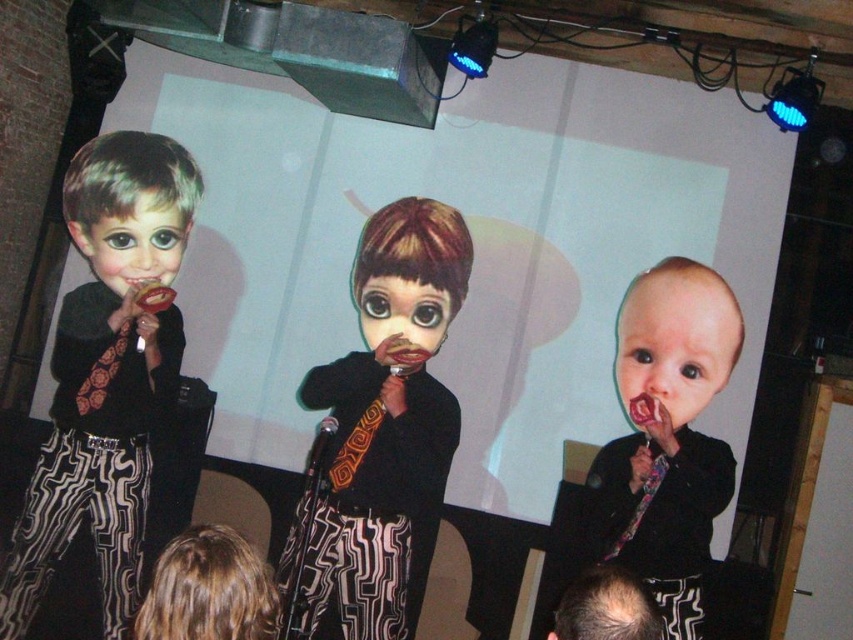
You are standing in front of the stage and want to locate the matte black suit at center. According to the coordinates provided, where would you find it?

The matte black suit at center is located at the coordinates point (665, 436).

You are standing on stage and see two points marked on the floor. The first point is at position point (688,621) and the second point is at point (595,600). Which point is closer to the audience if the audience is sitting in front of the stage?

Point (595,600) is closer to the audience because it is in front of point (688,621), which is behind it.

You are a stagehand responsible for arranging props during a performance. You notice two dolls on stage, the smooth skin baby at center and the matte plastic doll at center. Which one should you place on the higher shelf to prevent it from being knocked over by performers?

The smooth skin baby at center is smaller than the matte plastic doll at center, so placing the smaller smooth skin baby at center on the higher shelf would reduce the risk of it being knocked over by performers.